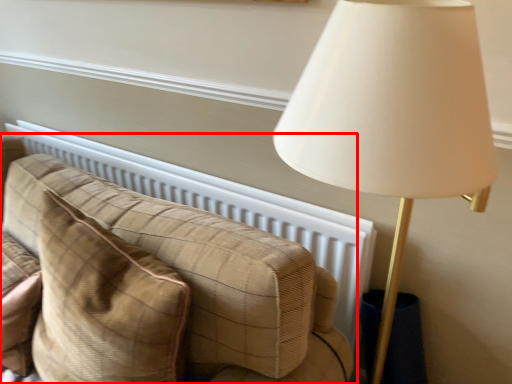
Question: From the image's perspective, considering the relative positions of studio couch (annotated by the red box) and throw pillow in the image provided, where is studio couch (annotated by the red box) located with respect to the staircase?

Choices:
 (A) below
 (B) above

Answer: (B)